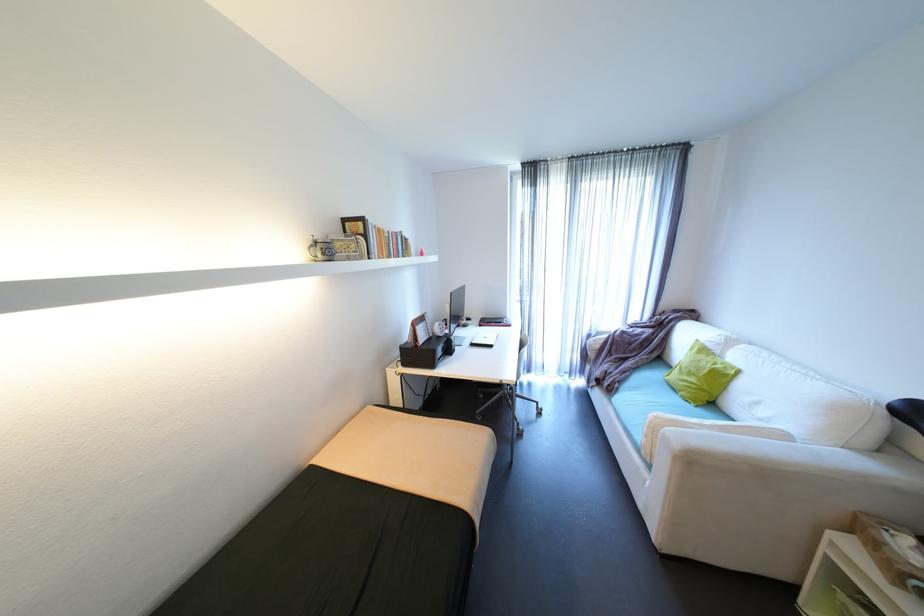
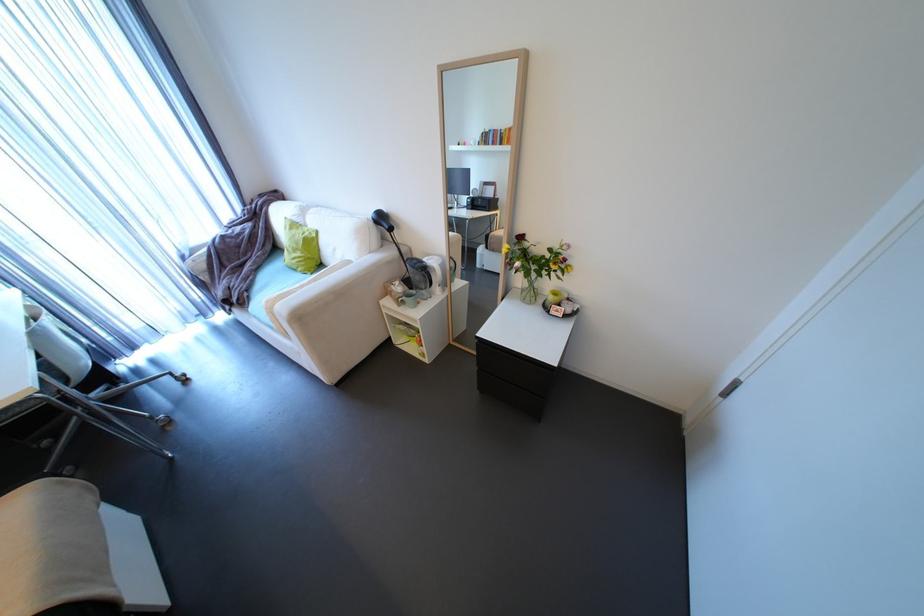
The point at (616, 389) is marked in the first image. Where is the corresponding point in the second image?

(248, 302)